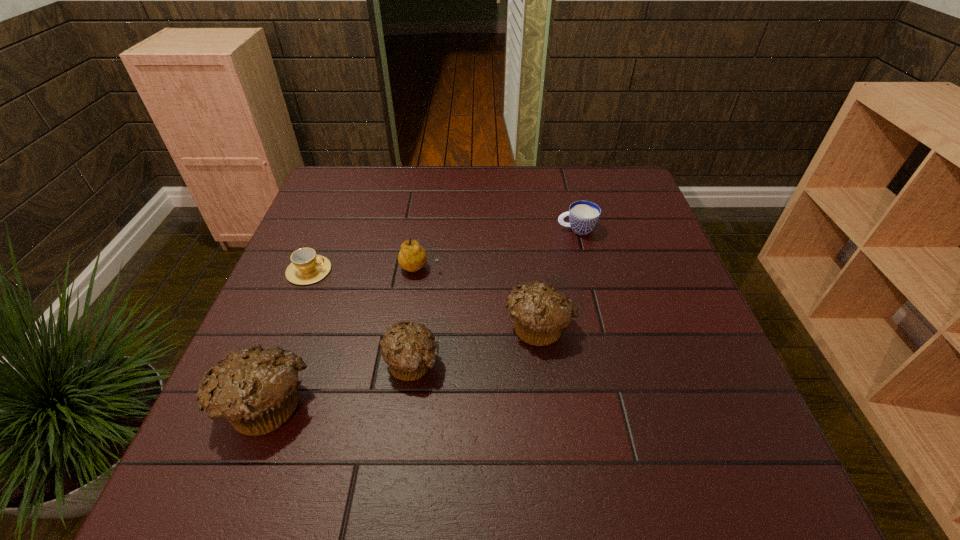
The width and height of the screenshot is (960, 540). I want to click on the leftmost muffin, so click(254, 389).

Locate an element on the screen. the shortest muffin is located at coordinates (409, 351).

Where is `the rightmost muffin`? the rightmost muffin is located at coordinates (541, 312).

Find the location of a particular element. the fifth object from left to right is located at coordinates (541, 312).

Locate an element on the screen. the rightmost object is located at coordinates (583, 215).

Locate an element on the screen. The height and width of the screenshot is (540, 960). the taller cup is located at coordinates (583, 215).

Where is `pear`? pear is located at coordinates (412, 257).

The image size is (960, 540). Identify the location of the left cup. (306, 268).

The height and width of the screenshot is (540, 960). I want to click on the shorter cup, so click(x=306, y=268).

Find the location of a particular element. The image size is (960, 540). blank area located on the right of the leftmost muffin is located at coordinates (419, 403).